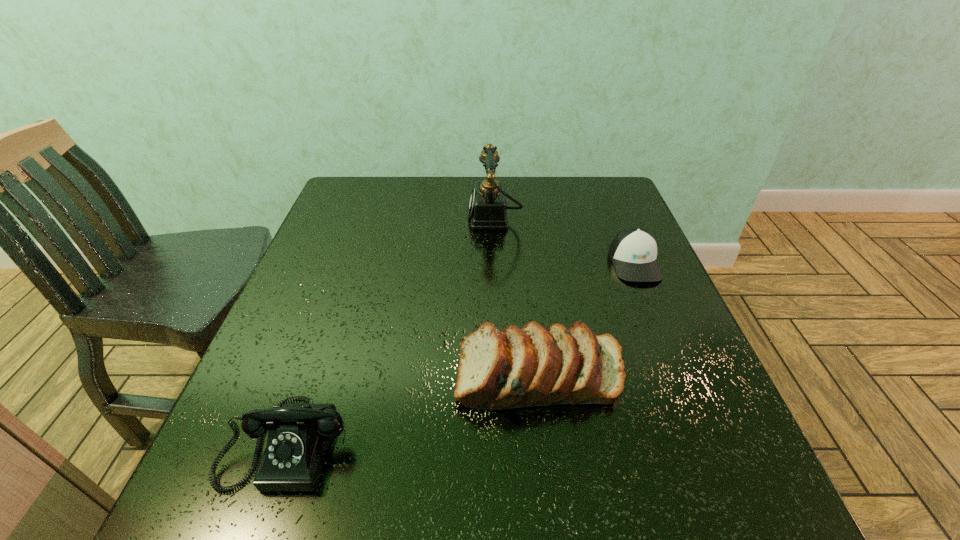
Locate an element on the screen. the taller telephone is located at coordinates (487, 208).

This screenshot has height=540, width=960. I want to click on the farther telephone, so click(x=487, y=208).

Where is `bread`? The width and height of the screenshot is (960, 540). bread is located at coordinates (534, 366).

This screenshot has width=960, height=540. I want to click on the left telephone, so click(299, 435).

Locate an element on the screen. The image size is (960, 540). the leftmost object is located at coordinates (299, 435).

At what (x,y) coordinates should I click in order to perform the action: click on cap. Please return your answer as a coordinate pair (x, y). The image size is (960, 540). Looking at the image, I should click on (633, 251).

At what (x,y) coordinates should I click in order to perform the action: click on the rightmost object. Please return your answer as a coordinate pair (x, y). Image resolution: width=960 pixels, height=540 pixels. Looking at the image, I should click on (633, 251).

Identify the location of vacant region located 0.150m on the front of the right telephone at the rotary dial. click(x=415, y=218).

I want to click on free space located 0.400m on the front of the right telephone at the rotary dial, so click(325, 218).

This screenshot has height=540, width=960. Identify the location of vacant region located on the front of the right telephone at the rotary dial. (361, 218).